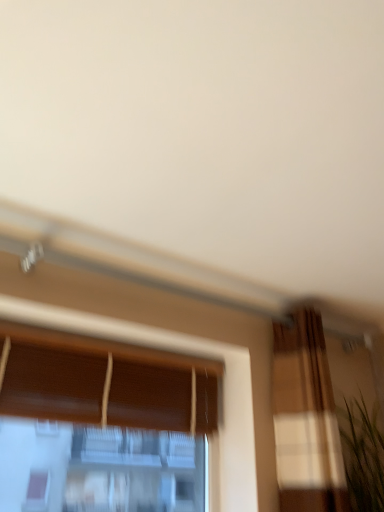
Question: From a real-world perspective, relative to green matte plant at right, is brown wood window at center vertically above or below?

Choices:
 (A) above
 (B) below

Answer: (A)

Question: Is brown wood window at center taller or shorter than green matte plant at right?

Choices:
 (A) short
 (B) tall

Answer: (B)

Question: Based on their sizes in the image, would you say brown wood window at center is bigger or smaller than green matte plant at right?

Choices:
 (A) small
 (B) big

Answer: (B)

Question: Visually, is green matte plant at right positioned to the left or to the right of brown wood window at center?

Choices:
 (A) left
 (B) right

Answer: (B)

Question: Is point (367, 466) closer or farther from the camera than point (157, 384)?

Choices:
 (A) farther
 (B) closer

Answer: (A)

Question: In the image, is green matte plant at right positioned in front of or behind brown wood window at center?

Choices:
 (A) behind
 (B) front

Answer: (A)

Question: Considering the positions of green matte plant at right and brown wood window at center in the image, is green matte plant at right bigger or smaller than brown wood window at center?

Choices:
 (A) small
 (B) big

Answer: (A)